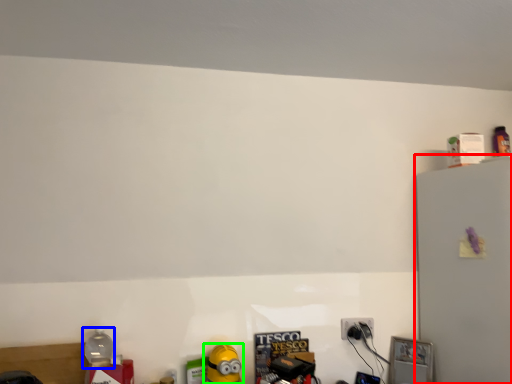
Question: Based on their relative distances, which object is farther from fridge (highlighted by a red box)? Choose from bottle (highlighted by a blue box) and toy (highlighted by a green box).

Choices:
 (A) bottle
 (B) toy

Answer: (A)